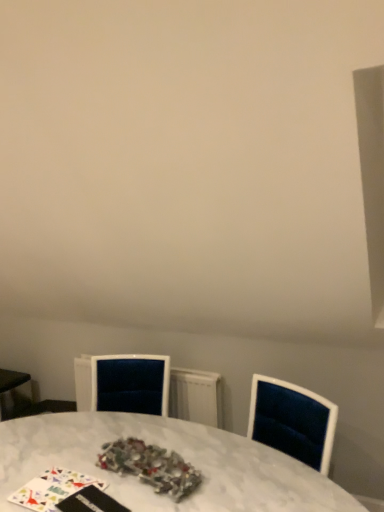
Question: From the image's perspective, does shiny metallic tinsel at center appear lower than velvet radiator at center?

Choices:
 (A) yes
 (B) no

Answer: (B)

Question: Is shiny metallic tinsel at center in front of velvet radiator at center?

Choices:
 (A) no
 (B) yes

Answer: (B)

Question: Is shiny metallic tinsel at center in contact with velvet radiator at center?

Choices:
 (A) yes
 (B) no

Answer: (B)

Question: Is shiny metallic tinsel at center taller than velvet radiator at center?

Choices:
 (A) no
 (B) yes

Answer: (A)

Question: Can you confirm if shiny metallic tinsel at center is thinner than velvet radiator at center?

Choices:
 (A) yes
 (B) no

Answer: (B)

Question: Is shiny metallic tinsel at center located outside velvet radiator at center?

Choices:
 (A) yes
 (B) no

Answer: (A)

Question: Can you confirm if white marble table at center is positioned to the right of velvet radiator at center?

Choices:
 (A) yes
 (B) no

Answer: (A)

Question: Does white marble table at center have a greater width compared to velvet radiator at center?

Choices:
 (A) no
 (B) yes

Answer: (B)

Question: Can you confirm if white marble table at center is taller than velvet radiator at center?

Choices:
 (A) yes
 (B) no

Answer: (A)

Question: Does white marble table at center turn towards velvet radiator at center?

Choices:
 (A) no
 (B) yes

Answer: (A)

Question: From the image's perspective, is white marble table at center over velvet radiator at center?

Choices:
 (A) yes
 (B) no

Answer: (B)

Question: Is white marble table at center to the left of velvet radiator at center from the viewer's perspective?

Choices:
 (A) yes
 (B) no

Answer: (B)

Question: From the image's perspective, would you say velvet radiator at center is positioned over white marble table at center?

Choices:
 (A) yes
 (B) no

Answer: (A)